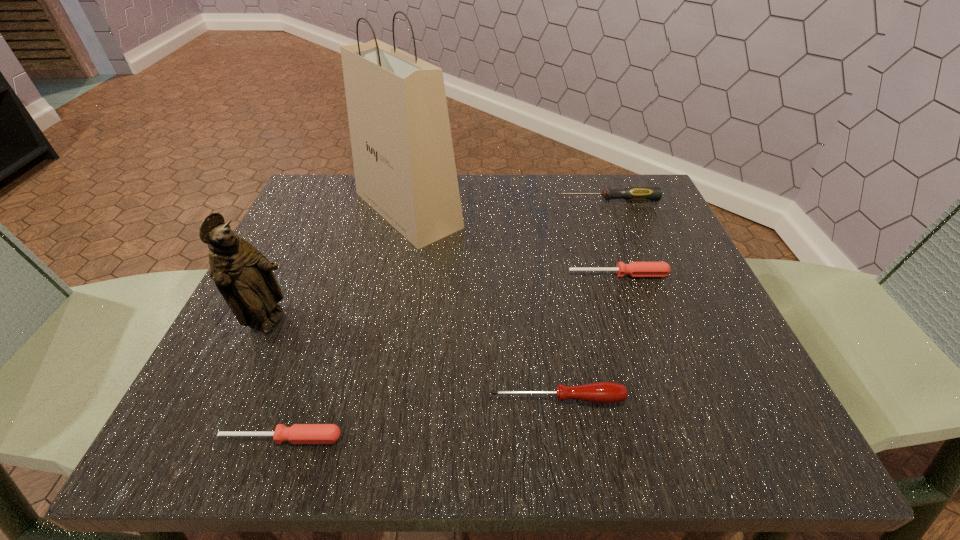
This screenshot has height=540, width=960. Find the location of `shopping bag`. shopping bag is located at coordinates (403, 157).

You are a GUI agent. You are given a task and a screenshot of the screen. Output one action in this format:
    pyautogui.click(x=<x>, y=<y>)
    Task: Click on the fifth shortest object
    The height and width of the screenshot is (540, 960).
    Given the screenshot: What is the action you would take?
    pyautogui.click(x=243, y=275)

Identify the location of figurine. (243, 275).

The image size is (960, 540). What are the coordinates of `the farthest screwdriver` in the screenshot? It's located at (630, 193).

Where is `the second nearest object`? The width and height of the screenshot is (960, 540). the second nearest object is located at coordinates (600, 392).

Find the location of a particular element. the third nearest screwdriver is located at coordinates (634, 269).

In order to click on the nearest object in this screenshot , I will do `click(298, 433)`.

In order to click on the nearest screwdriver in this screenshot , I will do `click(298, 433)`.

You are a GUI agent. You are given a task and a screenshot of the screen. Output one action in this format:
    pyautogui.click(x=<x>, y=<y>)
    Task: Click on the free space located 0.280m on the right of the shopping bag
    This screenshot has width=960, height=540.
    Given the screenshot: What is the action you would take?
    pyautogui.click(x=588, y=210)

Locate an element on the screen. vacant region located 0.070m on the front-facing side of the second tallest object is located at coordinates (336, 322).